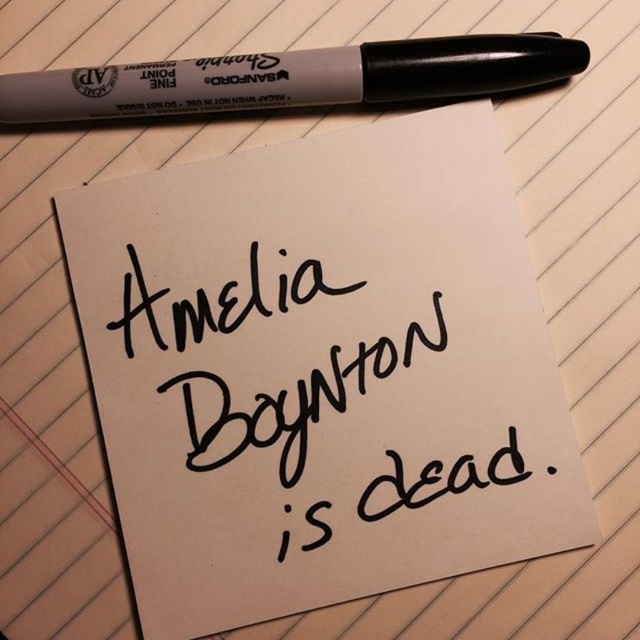
Is point (192, 374) in front of point (269, 428)?

No, it is behind (269, 428).

Is white paper at center taller than black handwritten text at center?

Indeed, white paper at center has a greater height compared to black handwritten text at center.

Find the location of `white paper at center`. white paper at center is located at coordinates (321, 372).

The width and height of the screenshot is (640, 640). I want to click on white paper at center, so click(x=321, y=372).

Based on the photo, is the position of black handwritten text at center less distant than that of black plastic pen at top?

No, it is not.

Which is more to the right, black handwritten text at center or black plastic pen at top?

Positioned to the right is black handwritten text at center.

Is point (221, 456) closer to camera compared to point (268, 96)?

No, (221, 456) is behind (268, 96).

Image resolution: width=640 pixels, height=640 pixels. Find the location of `black handwritten text at center`. black handwritten text at center is located at coordinates (291, 401).

Can you confirm if white paper at center is thinner than black plastic pen at top?

Indeed, white paper at center has a lesser width compared to black plastic pen at top.

Does white paper at center have a greater height compared to black plastic pen at top?

Yes.

What are the coordinates of `white paper at center` in the screenshot? It's located at (321, 372).